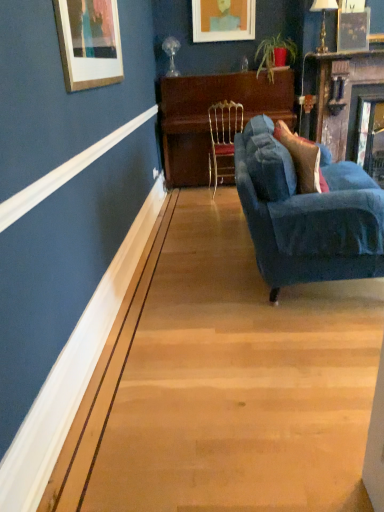
Question: Is gold wire chair at center located within wooden piano at center?

Choices:
 (A) no
 (B) yes

Answer: (B)

Question: Can you confirm if wooden piano at center is taller than gold wire chair at center?

Choices:
 (A) no
 (B) yes

Answer: (B)

Question: From the image's perspective, is wooden piano at center under gold wire chair at center?

Choices:
 (A) no
 (B) yes

Answer: (A)

Question: Is wooden piano at center to the left of gold wire chair at center from the viewer's perspective?

Choices:
 (A) no
 (B) yes

Answer: (A)

Question: Does wooden piano at center appear on the right side of gold wire chair at center?

Choices:
 (A) no
 (B) yes

Answer: (B)

Question: Can you confirm if wooden piano at center is shorter than gold wire chair at center?

Choices:
 (A) yes
 (B) no

Answer: (B)

Question: From the image's perspective, is matte orange picture frame at upper center above velvet blue pillow at right?

Choices:
 (A) yes
 (B) no

Answer: (A)

Question: Is the depth of matte orange picture frame at upper center greater than that of velvet blue pillow at right?

Choices:
 (A) no
 (B) yes

Answer: (B)

Question: Does matte orange picture frame at upper center have a larger size compared to velvet blue pillow at right?

Choices:
 (A) yes
 (B) no

Answer: (B)

Question: Can you confirm if matte orange picture frame at upper center is taller than velvet blue pillow at right?

Choices:
 (A) yes
 (B) no

Answer: (A)

Question: Is matte orange picture frame at upper center positioned with its back to velvet blue pillow at right?

Choices:
 (A) no
 (B) yes

Answer: (A)

Question: From a real-world perspective, is matte orange picture frame at upper center on top of velvet blue pillow at right?

Choices:
 (A) no
 (B) yes

Answer: (B)

Question: Considering the relative positions of wooden piano at center and wooden mantel at upper right in the image provided, is wooden piano at center in front of wooden mantel at upper right?

Choices:
 (A) no
 (B) yes

Answer: (A)